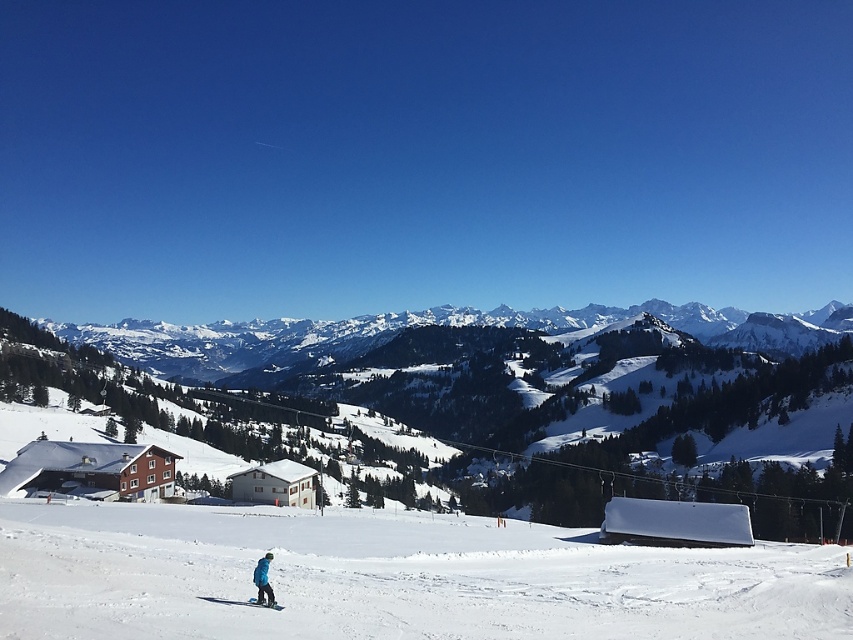
Question: Considering the relative positions of blue fabric snowsuit at lower center and matte blue ski at lower center in the image provided, where is blue fabric snowsuit at lower center located with respect to matte blue ski at lower center?

Choices:
 (A) left
 (B) right

Answer: (A)

Question: Estimate the real-world distances between objects in this image. Which object is farther from the white powdery snow at center?

Choices:
 (A) blue fabric snowsuit at lower center
 (B) matte blue ski at lower center

Answer: (B)

Question: Considering the real-world distances, which object is closest to the matte blue ski at lower center?

Choices:
 (A) blue fabric snowsuit at lower center
 (B) white powdery snow at center

Answer: (A)

Question: Does white powdery snow at center appear on the right side of blue fabric snowsuit at lower center?

Choices:
 (A) no
 (B) yes

Answer: (B)

Question: Is white powdery snow at center to the right of blue fabric snowsuit at lower center from the viewer's perspective?

Choices:
 (A) no
 (B) yes

Answer: (B)

Question: Which is farther from the blue fabric snowsuit at lower center?

Choices:
 (A) matte blue ski at lower center
 (B) white powdery snow at center

Answer: (B)